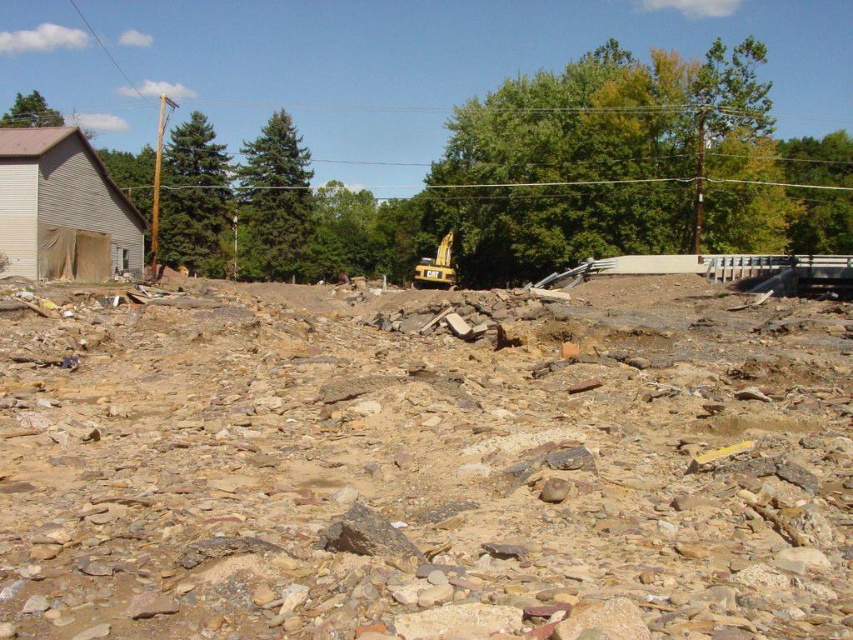
Question: Can you confirm if brown rocky debris at center is positioned to the right of yellow metallic excavator at center?

Choices:
 (A) yes
 (B) no

Answer: (B)

Question: Which point is farther to the camera?

Choices:
 (A) brown rocky debris at center
 (B) yellow metallic excavator at center

Answer: (B)

Question: Which object is farther from the camera taking this photo?

Choices:
 (A) yellow metallic excavator at center
 (B) brown rocky debris at center

Answer: (A)

Question: Is brown rocky debris at center further to the viewer compared to yellow metallic excavator at center?

Choices:
 (A) no
 (B) yes

Answer: (A)

Question: Can you confirm if brown rocky debris at center is positioned above yellow metallic excavator at center?

Choices:
 (A) yes
 (B) no

Answer: (B)